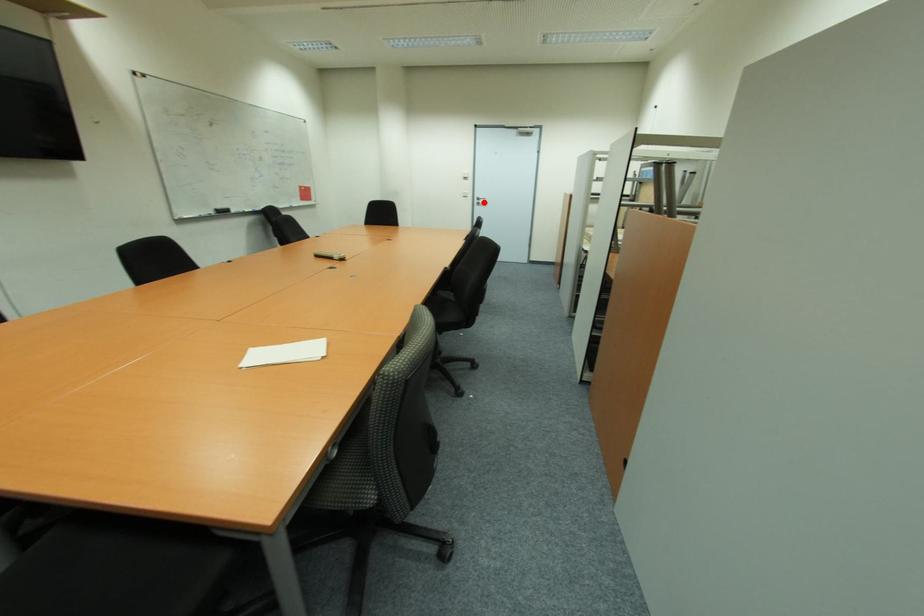
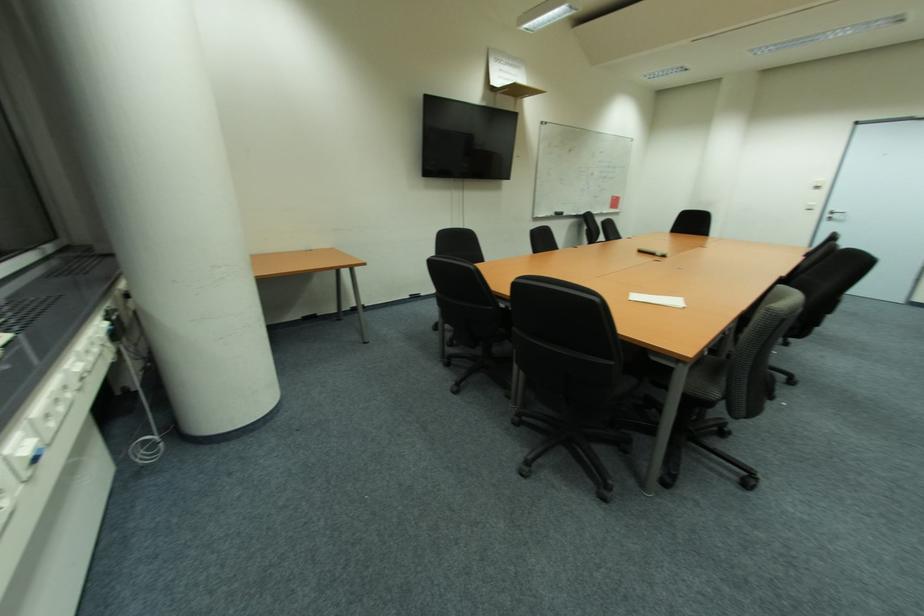
In the second image, find the point that corresponds to the highlighted location in the first image.

(842, 217)